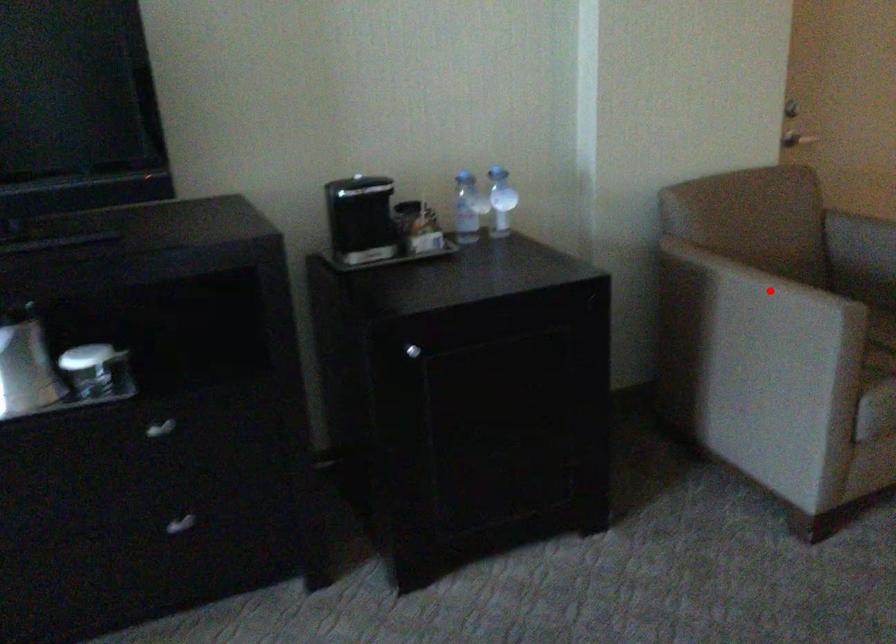
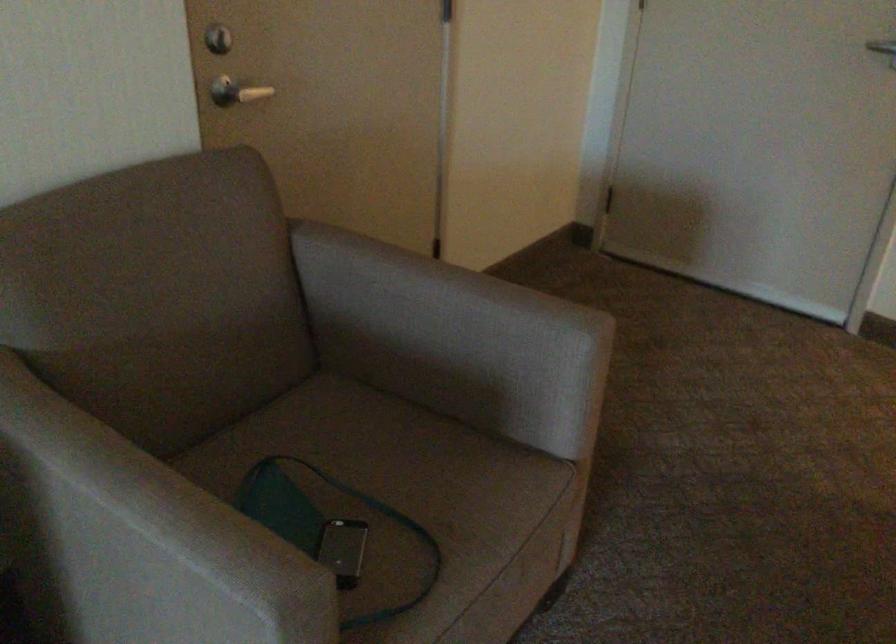
Locate, in the second image, the point that corresponds to the highlighted location in the first image.

(150, 538)